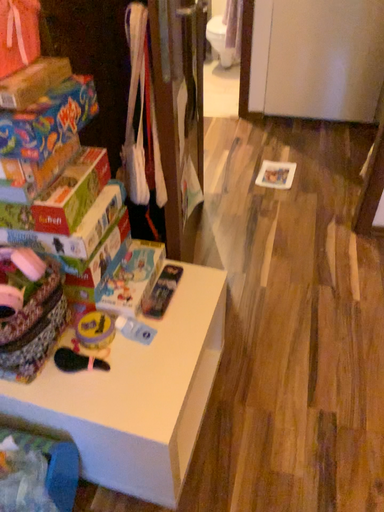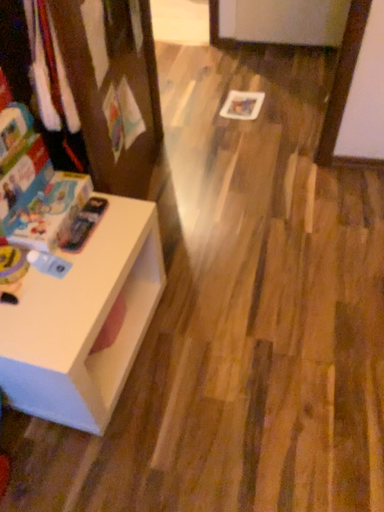
Question: How did the camera likely rotate when shooting the video?

Choices:
 (A) rotated downward
 (B) rotated upward

Answer: (A)